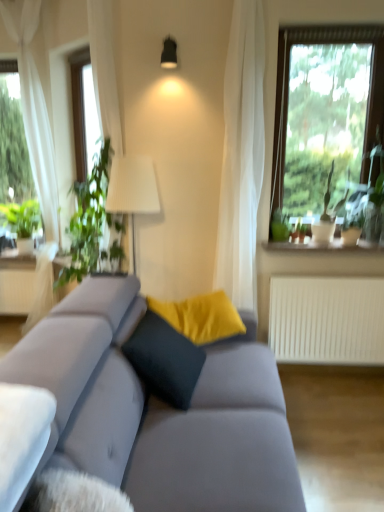
Question: From the image's perspective, would you say suede gray couch at center is shown under white ceramic vase at upper right?

Choices:
 (A) yes
 (B) no

Answer: (A)

Question: Is suede gray couch at center not inside white ceramic vase at upper right?

Choices:
 (A) no
 (B) yes

Answer: (B)

Question: From the image's perspective, would you say suede gray couch at center is positioned over white ceramic vase at upper right?

Choices:
 (A) no
 (B) yes

Answer: (A)

Question: Is suede gray couch at center taller than white ceramic vase at upper right?

Choices:
 (A) no
 (B) yes

Answer: (B)

Question: Is suede gray couch at center at the left side of white ceramic vase at upper right?

Choices:
 (A) yes
 (B) no

Answer: (A)

Question: Does suede gray couch at center have a greater width compared to white ceramic vase at upper right?

Choices:
 (A) yes
 (B) no

Answer: (A)

Question: From a real-world perspective, is suede gray couch at center located beneath green leafy plant at right?

Choices:
 (A) no
 (B) yes

Answer: (B)

Question: Is suede gray couch at center facing towards green leafy plant at right?

Choices:
 (A) no
 (B) yes

Answer: (A)

Question: From a real-world perspective, is suede gray couch at center over green leafy plant at right?

Choices:
 (A) no
 (B) yes

Answer: (A)

Question: Is suede gray couch at center wider than green leafy plant at right?

Choices:
 (A) no
 (B) yes

Answer: (B)

Question: Is suede gray couch at center turned away from green leafy plant at right?

Choices:
 (A) yes
 (B) no

Answer: (B)

Question: Does suede gray couch at center have a lesser width compared to green leafy plant at right?

Choices:
 (A) yes
 (B) no

Answer: (B)

Question: From the image's perspective, is white sheer curtain at left located above white ceramic vase at upper right?

Choices:
 (A) yes
 (B) no

Answer: (A)